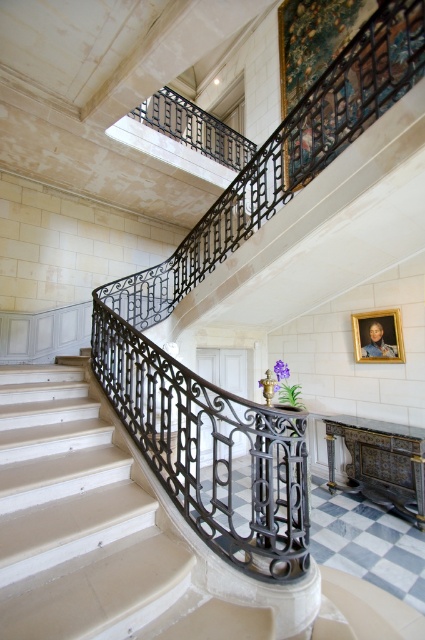
You are an interior designer planning to place a large sculpture in this space. The sculpture requires a spot that can accommodate its size. Given the polished marble stairs at center and the black wrought iron railing at center, which object would be more suitable for placing the sculpture next to based on their sizes?

The black wrought iron railing at center is larger than the polished marble stairs at center, so placing the sculpture next to the black wrought iron railing at center would be more suitable due to its larger size.

You are standing in the grand staircase area and need to locate two specific points marked in the image. The first point is at coordinates point (220,547) and the second is at point (373,360). From your current position, which point is closer to you?

Point (220,547) is in front of point (373,360), so the first point is closer to you.